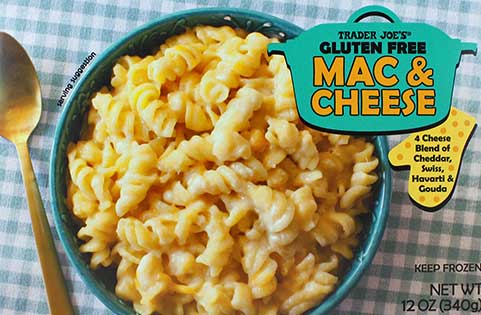
You are a GUI agent. You are given a task and a screenshot of the screen. Output one action in this format:
    pyautogui.click(x=<x>, y=<y>)
    Task: Click on the white cloth
    The width and height of the screenshot is (481, 315).
    Given the screenshot: What is the action you would take?
    pyautogui.click(x=52, y=42)